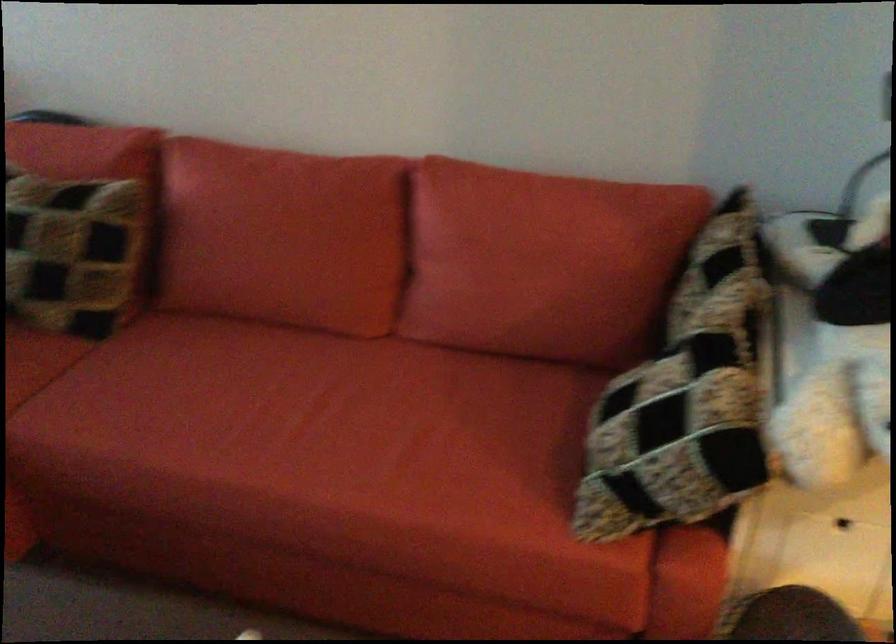
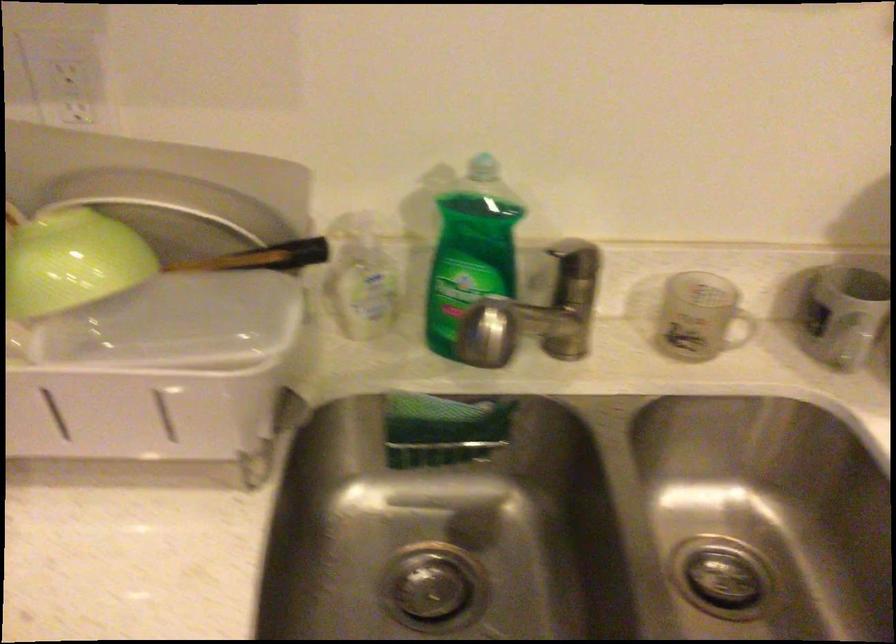
Question: What movement of the cameraman would produce the second image?

Choices:
 (A) Left
 (B) Right
 (C) Forward
 (D) Backward

Answer: (B)